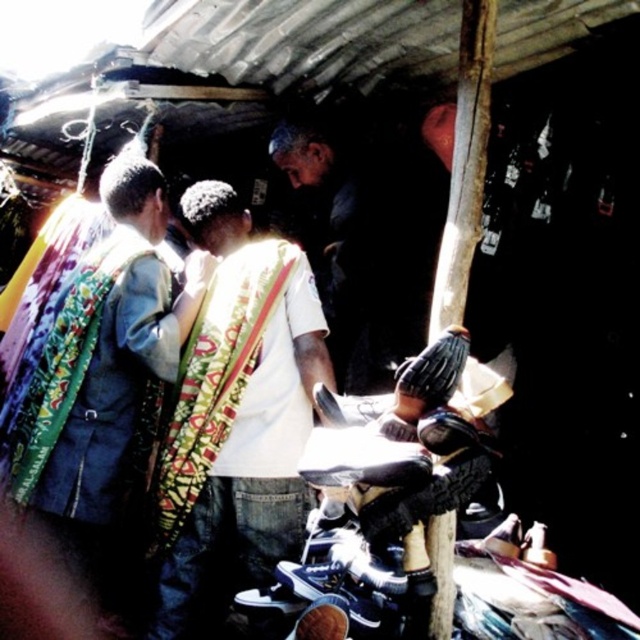
Is white cotton shirt at center in front of printed fabric vest at center?

Yes, white cotton shirt at center is closer to the viewer.

Can you confirm if white cotton shirt at center is positioned to the left of printed fabric vest at center?

In fact, white cotton shirt at center is to the right of printed fabric vest at center.

Locate an element on the screen. Image resolution: width=640 pixels, height=640 pixels. white cotton shirt at center is located at coordinates (243, 416).